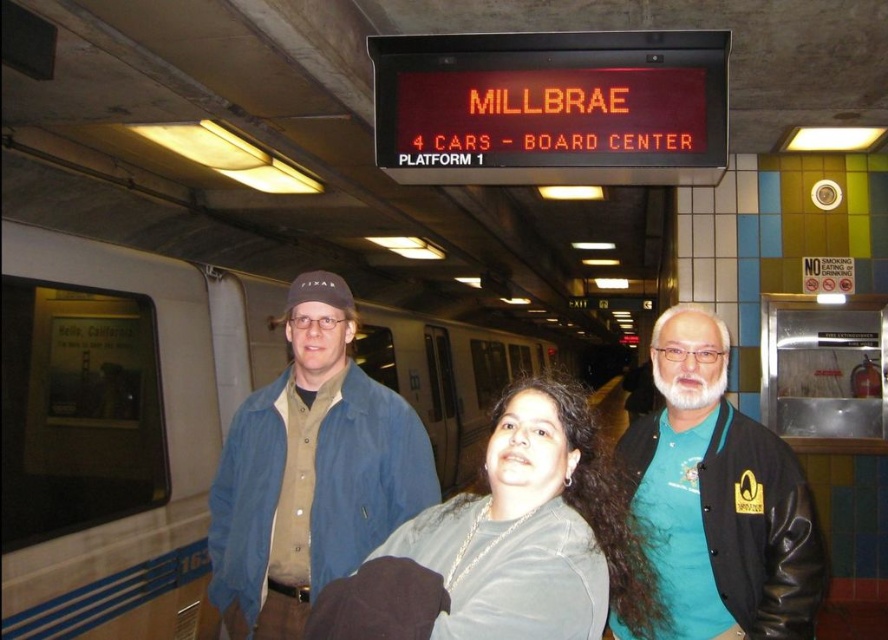
You are a photographer trying to capture a clear shot of the two people in the subway station. You notice the black leather jacket at right and the gray matte shirt at center. Which clothing item appears taller in the photo?

The black leather jacket at right appears taller than the gray matte shirt at center in the photo.

Consider the image. You are a photographer trying to capture a clear shot of the denim jacket at center and the black leather jacket at right. Since the digital sign is bright, you want to avoid glare. Which jacket is closer to the sign to potentially cause more glare?

The black leather jacket at right is closer to the digital sign because it is positioned above the denim jacket at center, so it might cause more glare.